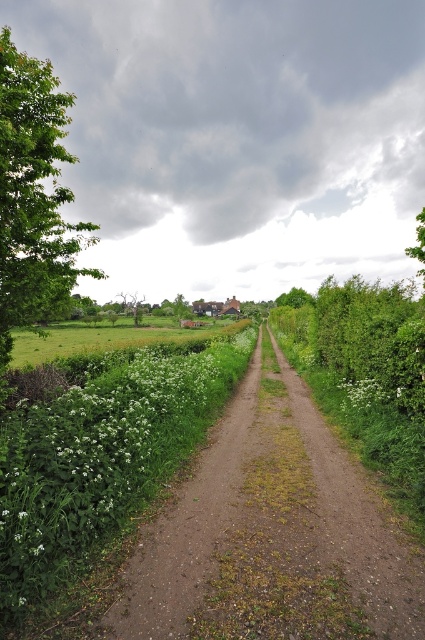
Question: Which object is the closest to the green leafy tree at left?

Choices:
 (A) green grassy field at center
 (B) white fluffy flower at center

Answer: (B)

Question: Is green leafy tree at left below green grassy field at center?

Choices:
 (A) yes
 (B) no

Answer: (B)

Question: Which point is closer to the camera taking this photo?

Choices:
 (A) (59, 252)
 (B) (16, 365)
 (C) (396, 397)

Answer: (C)

Question: Which is farther from the green grassy field at center?

Choices:
 (A) dirt path at center
 (B) green leafy tree at left

Answer: (B)

Question: Does dirt path at center come behind white fluffy flower at center?

Choices:
 (A) yes
 (B) no

Answer: (B)

Question: Is dirt path at center smaller than white fluffy flower at center?

Choices:
 (A) no
 (B) yes

Answer: (A)